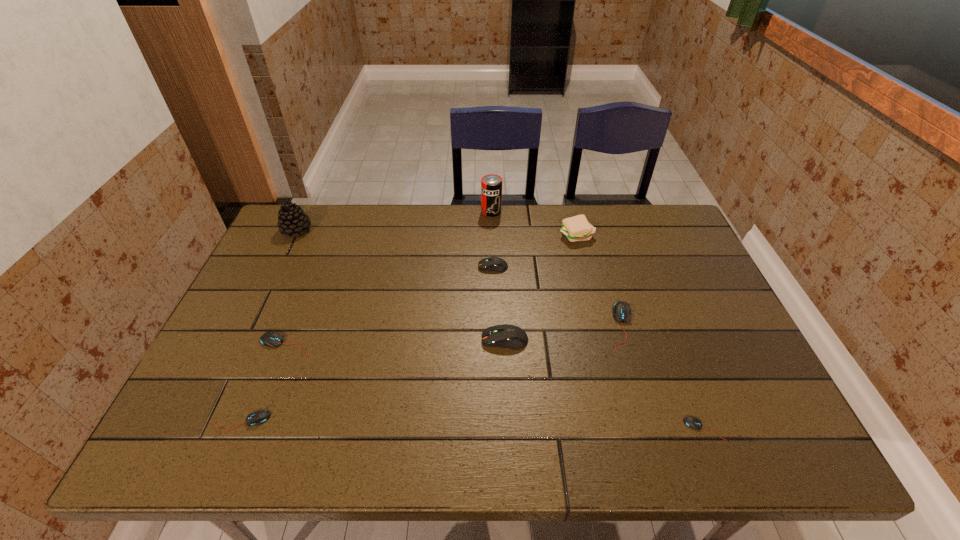
Locate an element on the screen. The width and height of the screenshot is (960, 540). the seventh tallest object is located at coordinates (272, 339).

At what (x,y) coordinates should I click in order to perform the action: click on the second biggest black mouse. Please return your answer as a coordinate pair (x, y). This screenshot has height=540, width=960. Looking at the image, I should click on tap(272, 339).

The width and height of the screenshot is (960, 540). Identify the location of the second shortest object. (259, 417).

At what (x,y) coordinates should I click in order to perform the action: click on the fifth tallest mouse. Please return your answer as a coordinate pair (x, y). Looking at the image, I should click on (259, 417).

The width and height of the screenshot is (960, 540). I want to click on the shortest object, so click(691, 422).

Identify the location of the shortest mouse. The width and height of the screenshot is (960, 540). (691, 422).

Find the location of a particular element. Image resolution: width=960 pixels, height=540 pixels. vacant point located on the left of the tallest object is located at coordinates (419, 212).

You are a GUI agent. You are given a task and a screenshot of the screen. Output one action in this format:
    pyautogui.click(x=<x>, y=<y>)
    Task: Click on the vacant space situated at the narrow end of the eighth shortest object
    
    Given the screenshot: What is the action you would take?
    pyautogui.click(x=429, y=231)

Identify the location of vacant space situated 0.060m on the back of the patty. The width and height of the screenshot is (960, 540). click(571, 215).

Identify the location of free spot located 0.340m on the button of the bigger dark computer equipment. (349, 340).